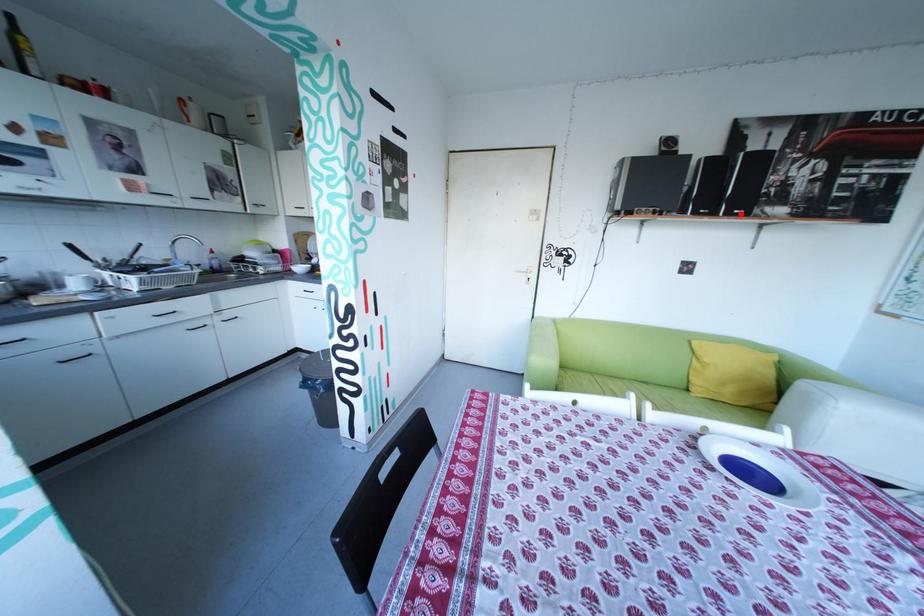
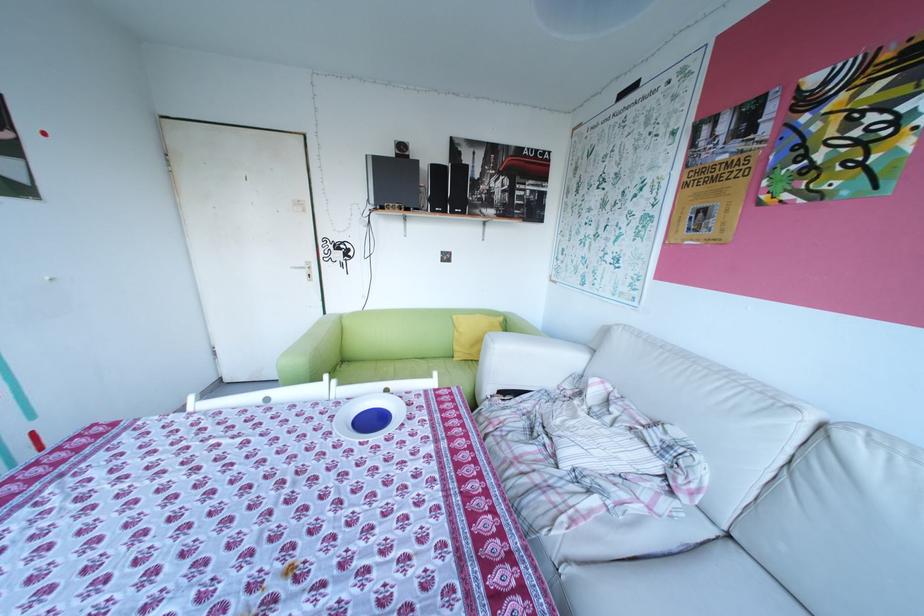
In the second image, find the point that corresponds to the highlighted location in the first image.

(466, 212)